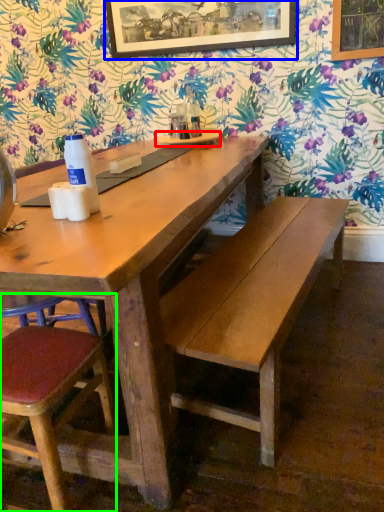
Question: Based on their relative distances, which object is nearer to plate (highlighted by a red box)? Choose from picture frame (highlighted by a blue box) and chair (highlighted by a green box).

Choices:
 (A) picture frame
 (B) chair

Answer: (A)